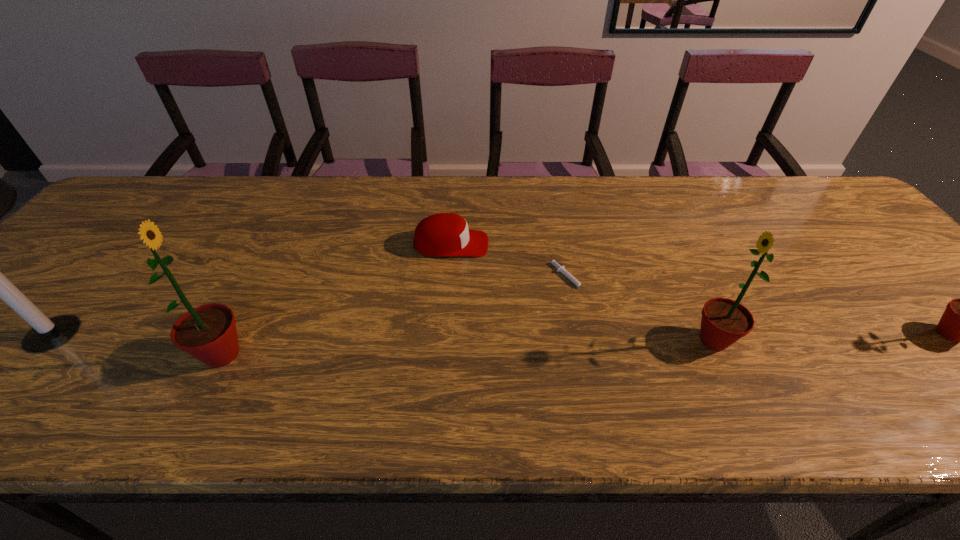
If we want them evenly spaced by inserting an extra sunflower among them, please locate a free spot for this new sunflower. Please provide its 2D coordinates. Your answer should be formatted as a tuple, i.e. [(x, y)], where the tuple contains the x and y coordinates of a point satisfying the conditions above.

[(471, 347)]